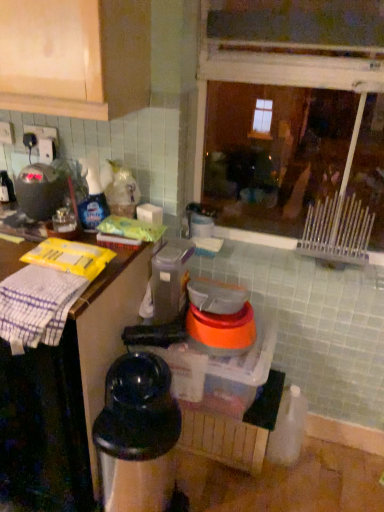
Consider the image. Measure the distance between point (16, 329) and camera.

A distance of 3.63 feet exists between point (16, 329) and camera.

Describe the element at coordinates (274, 153) in the screenshot. This screenshot has height=512, width=384. I see `transparent glass window at upper center` at that location.

I want to click on white checkered cloth at left, so click(x=37, y=306).

This screenshot has width=384, height=512. Identify the location of window on the right of matte black kettle at left, which is the 3th appliance in bottom-to-top order. [274, 153].

Considering the positions of points (303, 183) and (43, 178), is point (303, 183) closer to camera compared to point (43, 178)?

That is False.

From the image's perspective, is transparent glass window at upper center positioned above or below matte black kettle at left, marked as the 1th appliance in a top-to-bottom arrangement?

From the image's perspective, transparent glass window at upper center appears above matte black kettle at left, marked as the 1th appliance in a top-to-bottom arrangement.

Does transparent glass window at upper center have a greater width compared to matte black kettle at left, marked as the 1th appliance in a top-to-bottom arrangement?

No.

Does black plastic coffee maker at lower left, marked as the 2th appliance in a right-to-left arrangement, lie in front of white cloth at left?

No.

Is the surface of black plastic coffee maker at lower left, the 2th appliance in the left-to-right sequence, in direct contact with white cloth at left?

No, black plastic coffee maker at lower left, the 2th appliance in the left-to-right sequence, is not making contact with white cloth at left.

How different are the orientations of black plastic coffee maker at lower left, the 2th appliance in the left-to-right sequence, and white cloth at left in degrees?

There is a 0.000771-degree angle between the facing directions of black plastic coffee maker at lower left, the 2th appliance in the left-to-right sequence, and white cloth at left.

How distant is black plastic coffee maker at lower left, marked as the 2th appliance in a right-to-left arrangement, from white cloth at left?

black plastic coffee maker at lower left, marked as the 2th appliance in a right-to-left arrangement, and white cloth at left are 18.07 centimeters apart.

At what (x,y) coordinates should I click in order to perform the action: click on appliance on the left of white cloth at left. Please return your answer as a coordinate pair (x, y). Looking at the image, I should click on 40,190.

Is matte black kettle at left, which appears as the third appliance when viewed from the right, aimed at white cloth at left?

No, matte black kettle at left, which appears as the third appliance when viewed from the right, does not turn towards white cloth at left.

From a real-world perspective, which object stands above the other?

From a 3D spatial view, matte black kettle at left, marked as the 1th appliance in a top-to-bottom arrangement, is above.

Does white cloth at left have a greater height compared to black plastic coffee maker at lower left, the first appliance positioned from the bottom?

Yes.

Looking at this image, from a real-world perspective, is white cloth at left above or below black plastic coffee maker at lower left, marked as the 2th appliance in a right-to-left arrangement?

Clearly, from a real-world perspective, white cloth at left is above black plastic coffee maker at lower left, marked as the 2th appliance in a right-to-left arrangement.

Which object is further away from the camera, white cloth at left or black plastic coffee maker at lower left, the first appliance positioned from the bottom?

Positioned behind is black plastic coffee maker at lower left, the first appliance positioned from the bottom.

Which point is more forward, (x=131, y=323) or (x=106, y=390)?

The point (x=106, y=390) is closer.

Relative to white checkered cloth at left, is transparent glass window at upper center in front or behind?

Visually, transparent glass window at upper center is located behind white checkered cloth at left.

Consider the image. From the image's perspective, which one is positioned higher, transparent glass window at upper center or white checkered cloth at left?

transparent glass window at upper center is shown above in the image.

Is transparent glass window at upper center turned away from white checkered cloth at left?

No.

Considering the positions of objects white checkered cloth at left and orange plastic bowls at center, the second appliance when ordered from top to bottom, in the image provided, who is behind, white checkered cloth at left or orange plastic bowls at center, the second appliance when ordered from top to bottom,?

orange plastic bowls at center, the second appliance when ordered from top to bottom, is more distant.

From the image's perspective, would you say white checkered cloth at left is positioned over orange plastic bowls at center, marked as the first appliance in a right-to-left arrangement?

Yes.

From a real-world perspective, which is physically above, white checkered cloth at left or orange plastic bowls at center, the second appliance when ordered from top to bottom?

white checkered cloth at left is physically above.

Do you think white checkered cloth at left is within orange plastic bowls at center, positioned as the 3th appliance in left-to-right order, or outside of it?

white checkered cloth at left is spatially situated outside orange plastic bowls at center, positioned as the 3th appliance in left-to-right order.

Considering the relative sizes of white checkered cloth at left and matte black kettle at left, which is the 3th appliance in bottom-to-top order, in the image provided, is white checkered cloth at left wider than matte black kettle at left, which is the 3th appliance in bottom-to-top order,?

Yes.

Is point (45, 317) less distant than point (57, 208)?

Yes.

Is white checkered cloth at left oriented away from matte black kettle at left, which appears as the third appliance when viewed from the right?

white checkered cloth at left is not turned away from matte black kettle at left, which appears as the third appliance when viewed from the right.

From a real-world perspective, is white checkered cloth at left under matte black kettle at left, marked as the 1th appliance in a top-to-bottom arrangement?

Yes, from a real-world perspective, white checkered cloth at left is beneath matte black kettle at left, marked as the 1th appliance in a top-to-bottom arrangement.

There is a transparent glass window at upper center. Identify the location of the 1st appliance below it (from a real-world perspective). (40, 190).

Identify the location of countertop lying on the left of black plastic coffee maker at lower left, the third appliance when ordered from top to bottom. (66, 393).

Based on their spatial positions, is black plastic coffee maker at lower left, the 2th appliance in the left-to-right sequence, or matte black kettle at left, marked as the 1th appliance in a top-to-bottom arrangement, further from white cloth at left?

matte black kettle at left, marked as the 1th appliance in a top-to-bottom arrangement, is further to white cloth at left.

Considering their positions, is white checkered cloth at left positioned closer to transparent glass window at upper center than orange plastic bowls at center, positioned as the 3th appliance in left-to-right order?

orange plastic bowls at center, positioned as the 3th appliance in left-to-right order.

Estimate the real-world distances between objects in this image. Which object is further from orange plastic bowls at center, the second appliance when ordered from top to bottom, white cloth at left or black plastic coffee maker at lower left, the third appliance when ordered from top to bottom?

white cloth at left.

Looking at the image, which one is located closer to matte black kettle at left, which appears as the third appliance when viewed from the right, white cloth at left or black plastic coffee maker at lower left, the third appliance when ordered from top to bottom?

Among the two, white cloth at left is located nearer to matte black kettle at left, which appears as the third appliance when viewed from the right.

Consider the image. Looking at the image, which one is located closer to transparent glass window at upper center, matte black kettle at left, marked as the 1th appliance in a top-to-bottom arrangement, or orange plastic bowls at center, positioned as the 3th appliance in left-to-right order?

orange plastic bowls at center, positioned as the 3th appliance in left-to-right order, is closer to transparent glass window at upper center.

Considering their positions, is white checkered cloth at left positioned further to black plastic coffee maker at lower left, marked as the 2th appliance in a right-to-left arrangement, than matte black kettle at left, placed as the first appliance when sorted from left to right?

Based on the image, matte black kettle at left, placed as the first appliance when sorted from left to right, appears to be further to black plastic coffee maker at lower left, marked as the 2th appliance in a right-to-left arrangement.

From the image, which object appears to be nearer to black plastic coffee maker at lower left, marked as the 2th appliance in a right-to-left arrangement, matte black kettle at left, placed as the first appliance when sorted from left to right, or transparent glass window at upper center?

matte black kettle at left, placed as the first appliance when sorted from left to right, lies closer to black plastic coffee maker at lower left, marked as the 2th appliance in a right-to-left arrangement, than the other object.

Looking at the image, which one is located closer to orange plastic bowls at center, the 2th appliance ordered from the bottom, transparent glass window at upper center or white checkered cloth at left?

white checkered cloth at left is positioned closer to the anchor orange plastic bowls at center, the 2th appliance ordered from the bottom.

The height and width of the screenshot is (512, 384). I want to click on appliance between white checkered cloth at left and black plastic coffee maker at lower left, the third appliance when ordered from top to bottom, in the up-down direction, so click(x=220, y=316).

You are a GUI agent. You are given a task and a screenshot of the screen. Output one action in this format:
    pyautogui.click(x=<x>, y=<y>)
    Task: Click on the appliance situated between white cloth at left and orange plastic bowls at center, the 2th appliance ordered from the bottom, from left to right
    This screenshot has height=512, width=384.
    Given the screenshot: What is the action you would take?
    pyautogui.click(x=137, y=435)

What are the coordinates of `cloth that lies between matte black kettle at left, which is the 3th appliance in bottom-to-top order, and black plastic coffee maker at lower left, marked as the 2th appliance in a right-to-left arrangement, from top to bottom` in the screenshot? It's located at (37, 306).

Where is `countertop situated between matte black kettle at left, which is the 3th appliance in bottom-to-top order, and transparent glass window at upper center from left to right`? The image size is (384, 512). countertop situated between matte black kettle at left, which is the 3th appliance in bottom-to-top order, and transparent glass window at upper center from left to right is located at coordinates (66, 393).